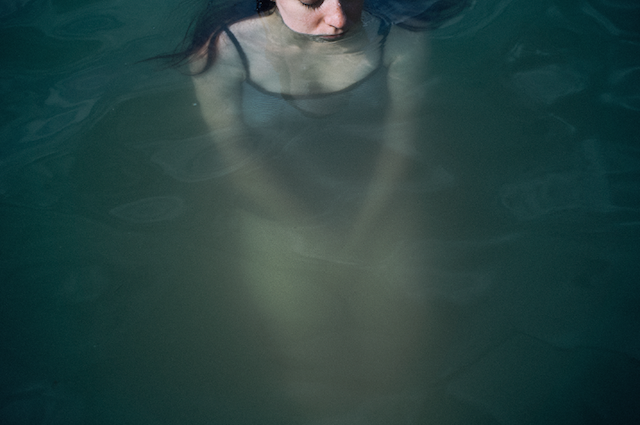
Locate an element on the screen. chest is located at coordinates (268, 100), (288, 65), (347, 60), (370, 100).